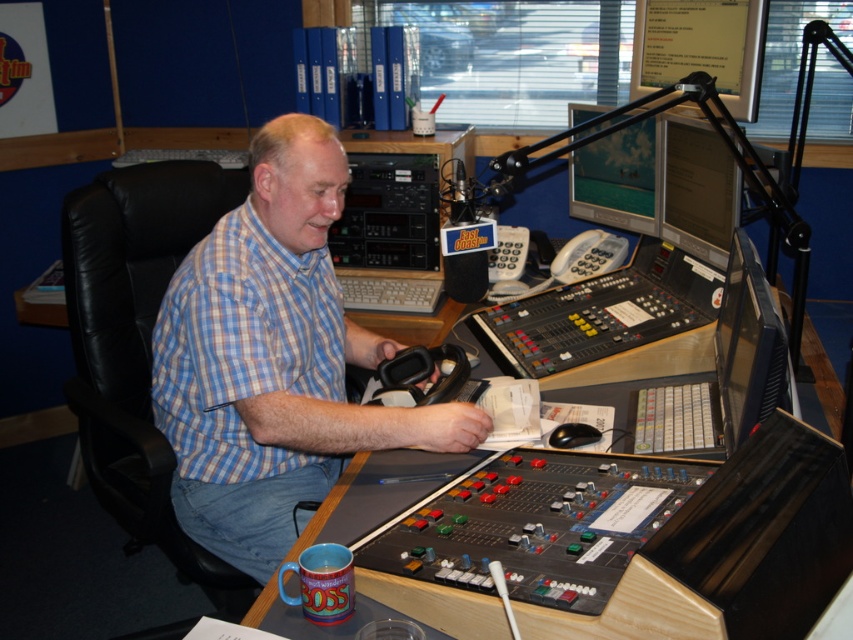
Is black leather swivel chair at left to the right of blue plaid shirt at center from the viewer's perspective?

No, black leather swivel chair at left is not to the right of blue plaid shirt at center.

Looking at this image, is black leather swivel chair at left wider than blue plaid shirt at center?

Yes.

Identify the location of black leather swivel chair at left. pyautogui.click(x=138, y=346).

Can you confirm if blue plaid shirt at center is smaller than matte plastic monitor at upper center?

No.

Describe the element at coordinates (242, 346) in the screenshot. I see `blue plaid shirt at center` at that location.

Find the location of a particular element. Image resolution: width=853 pixels, height=640 pixels. blue plaid shirt at center is located at coordinates (242, 346).

Is point (331, 412) less distant than point (178, 262)?

That is True.

From the picture: Can you confirm if blue checkered shirt at center is wider than black leather swivel chair at left?

Indeed, blue checkered shirt at center has a greater width compared to black leather swivel chair at left.

Find the location of `blue checkered shirt at center`. blue checkered shirt at center is located at coordinates (273, 358).